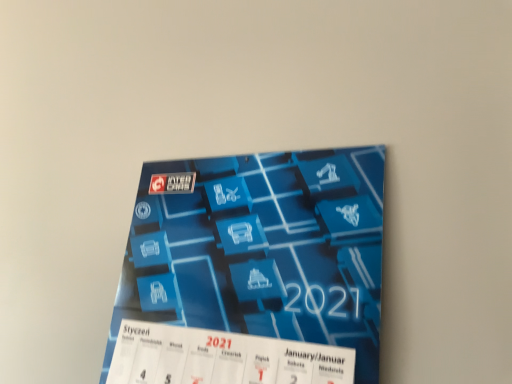
What do you see at coordinates (252, 271) in the screenshot? I see `blue glossy calendar at center` at bounding box center [252, 271].

Identify the location of blue glossy calendar at center. (252, 271).

At what (x,y) coordinates should I click in order to perform the action: click on blue glossy calendar at center. Please return your answer as a coordinate pair (x, y). The height and width of the screenshot is (384, 512). Looking at the image, I should click on (252, 271).